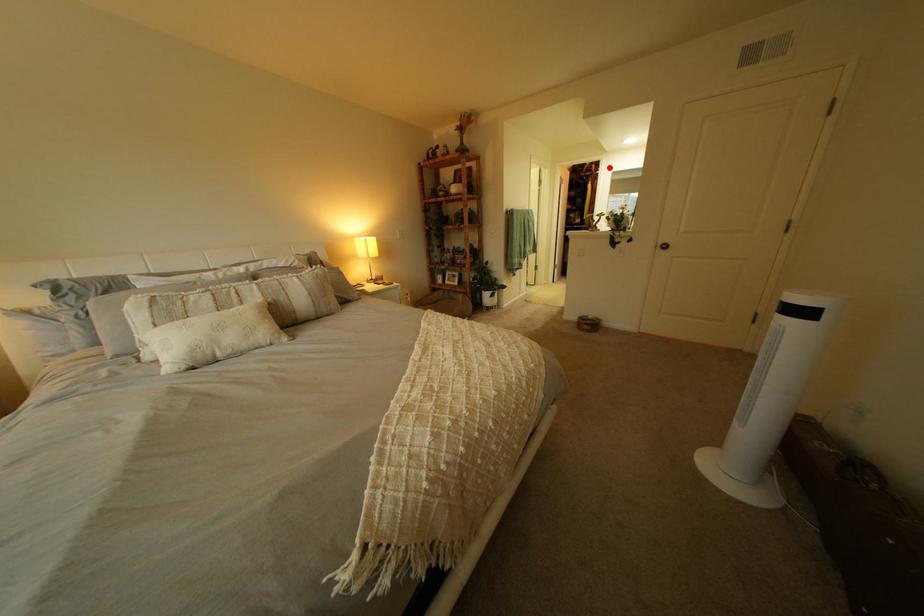
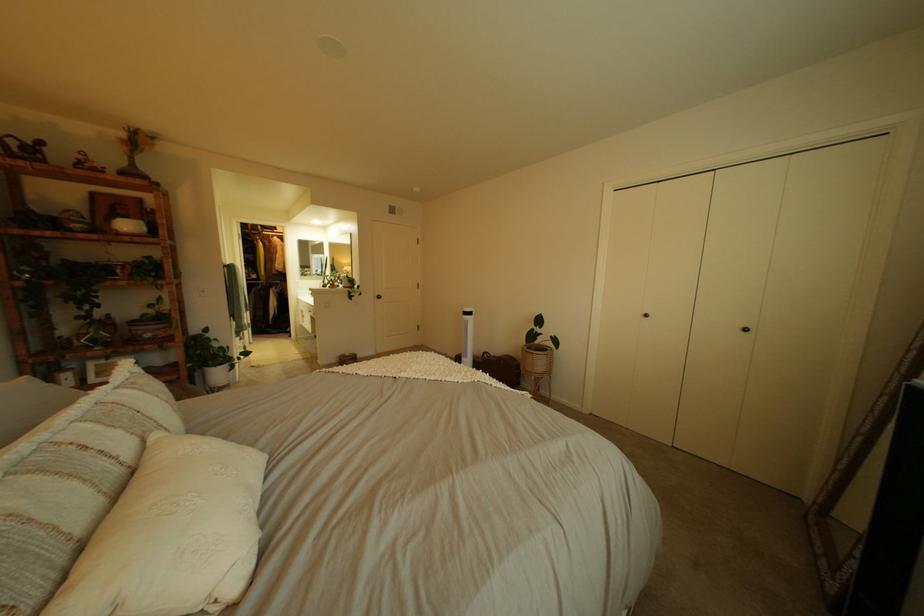
In the second image, find the point that corresponds to the highlighted location in the first image.

(274, 228)